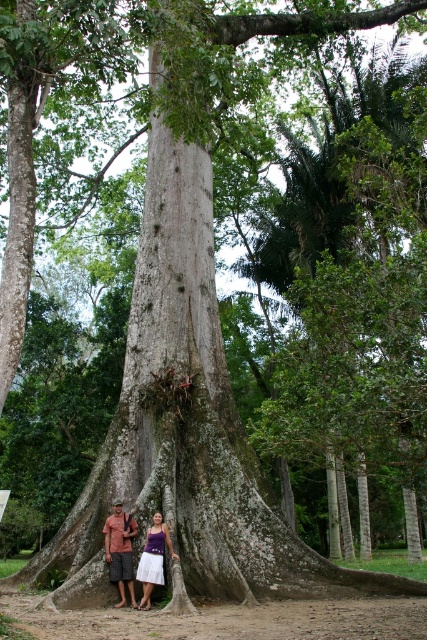
Who is positioned more to the right, brown cotton shirt at lower center or white cotton dress at lower center?

Positioned to the right is white cotton dress at lower center.

Locate an element on the screen. brown cotton shirt at lower center is located at coordinates (119, 550).

Is white cotton dress at center thinner than brown cotton shirt at lower center?

In fact, white cotton dress at center might be wider than brown cotton shirt at lower center.

Based on the photo, does white cotton dress at center have a lesser height compared to brown cotton shirt at lower center?

Yes.

Locate an element on the screen. The image size is (427, 640). white cotton dress at center is located at coordinates (131, 554).

Find the location of a particular element. white cotton dress at center is located at coordinates (131, 554).

Is white cotton dress at center to the right of white cotton dress at lower center from the viewer's perspective?

Incorrect, white cotton dress at center is not on the right side of white cotton dress at lower center.

Is point (155, 515) positioned in front of point (160, 518)?

No, it is not.

Where is `white cotton dress at center`? This screenshot has width=427, height=640. white cotton dress at center is located at coordinates (131, 554).